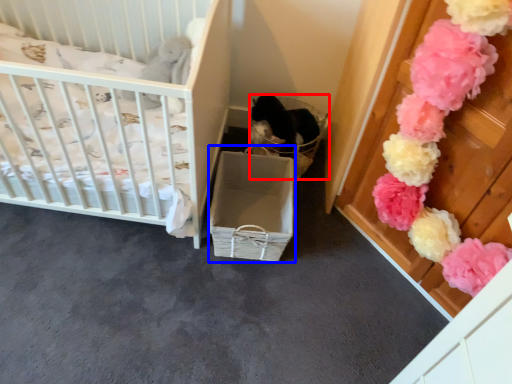
Question: Which object appears farthest to the camera in this image, basket (highlighted by a red box) or crate (highlighted by a blue box)?

Choices:
 (A) basket
 (B) crate

Answer: (A)